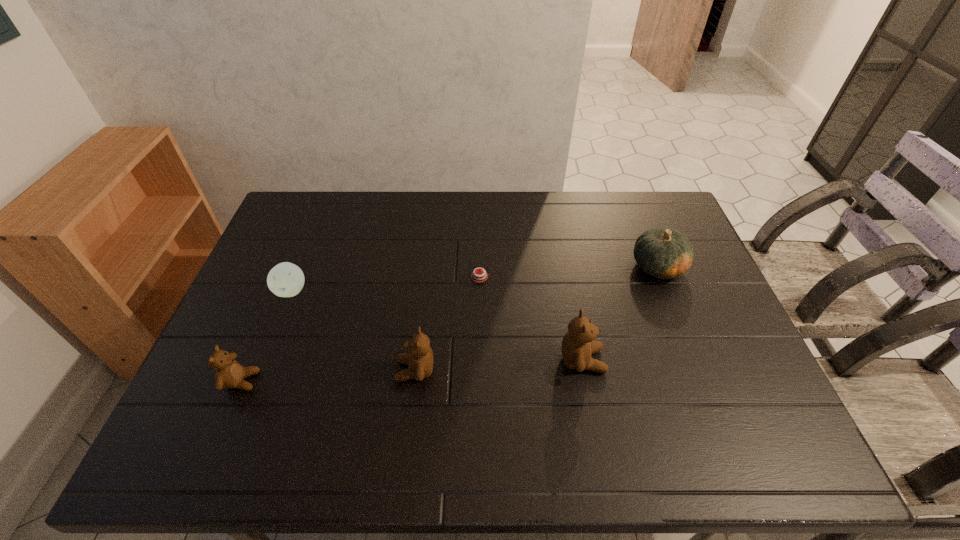
Image resolution: width=960 pixels, height=540 pixels. Identify the location of blank region between the gourd and the shortest object. (569, 272).

You are a GUI agent. You are given a task and a screenshot of the screen. Output one action in this format:
    pyautogui.click(x=<x>, y=<y>)
    Task: Click on the empty location between the rightmost teddy bear and the fifth tallest object
    Image resolution: width=960 pixels, height=540 pixels.
    Given the screenshot: What is the action you would take?
    pyautogui.click(x=437, y=326)

Find the location of `object that is the fourth nearest to the gourd`. object that is the fourth nearest to the gourd is located at coordinates (286, 279).

Where is `object that ranks as the fourth closest to the leftmost teddy bear`? This screenshot has height=540, width=960. object that ranks as the fourth closest to the leftmost teddy bear is located at coordinates point(577,345).

Identify the location of teddy bear that is the second closest one to the apple. The height and width of the screenshot is (540, 960). [419, 357].

You are a GUI agent. You are given a task and a screenshot of the screen. Output one action in this format:
    pyautogui.click(x=<x>, y=<y>)
    Task: Click on the closest teddy bear to the fourth object from left to right
    Image resolution: width=960 pixels, height=540 pixels.
    Given the screenshot: What is the action you would take?
    pyautogui.click(x=419, y=357)